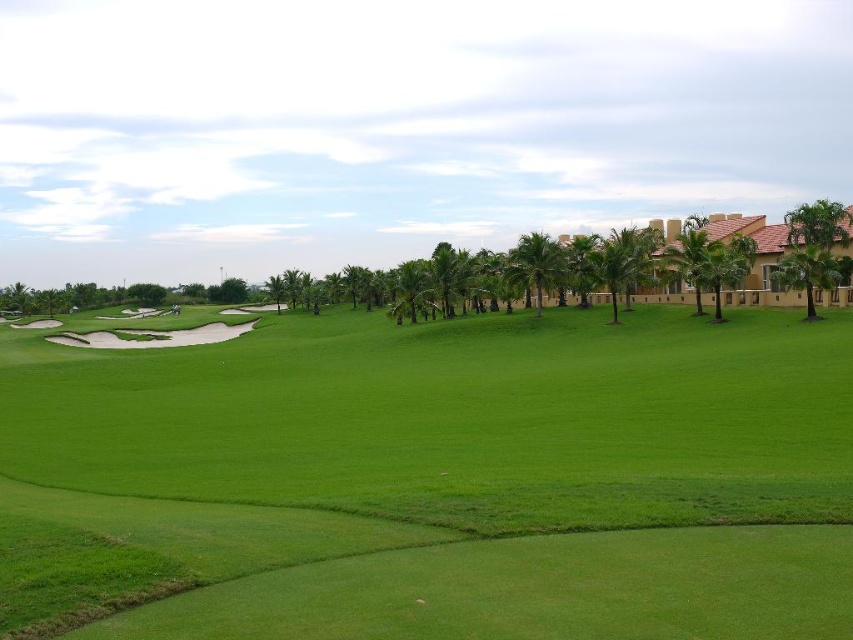
Who is more distant from viewer, (x=799, y=220) or (x=407, y=282)?

Point (x=407, y=282)

What do you see at coordinates (813, 248) in the screenshot? I see `green leafy palm tree at right` at bounding box center [813, 248].

Locate an element on the screen. This screenshot has width=853, height=640. green leafy palm tree at right is located at coordinates (813, 248).

Who is positioned more to the right, green grassy field at center or green leafy palm tree at center-right?

green leafy palm tree at center-right is more to the right.

Is point (38, 422) positioned before point (508, 257)?

Yes, it is in front of point (508, 257).

Identify the location of green grassy field at center. The image size is (853, 640). (440, 477).

The width and height of the screenshot is (853, 640). Identify the location of green grassy field at center. (440, 477).

Who is higher up, green grassy field at center or green leafy palm tree at right?

green leafy palm tree at right

Who is lower down, green grassy field at center or green leafy palm tree at right?

green grassy field at center is below.

In order to click on green grassy field at center in this screenshot , I will do `click(440, 477)`.